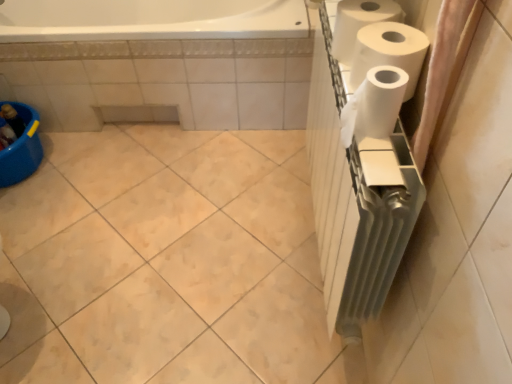
Question: Can you confirm if white matte paper towel at right, which is the first paper towel in front-to-back order, is wider than white matte paper towel at right, the second paper towel in the back-to-front sequence?

Choices:
 (A) no
 (B) yes

Answer: (A)

Question: From the image's perspective, is white matte paper towel at right, the third paper towel when ordered from back to front, located above white matte paper towel at right, the second paper towel in the back-to-front sequence?

Choices:
 (A) no
 (B) yes

Answer: (A)

Question: Considering the relative sizes of white matte paper towel at right, the third paper towel when ordered from back to front, and white matte paper towel at right, the second paper towel in the back-to-front sequence, in the image provided, is white matte paper towel at right, the third paper towel when ordered from back to front, taller than white matte paper towel at right, the second paper towel in the back-to-front sequence,?

Choices:
 (A) yes
 (B) no

Answer: (B)

Question: From a real-world perspective, is white matte paper towel at right, which is the first paper towel in front-to-back order, physically below white matte paper towel at right, the second paper towel in the back-to-front sequence?

Choices:
 (A) no
 (B) yes

Answer: (A)

Question: Is white matte paper towel at right, the third paper towel when ordered from back to front, not inside white matte paper towel at right, the second paper towel in the back-to-front sequence?

Choices:
 (A) yes
 (B) no

Answer: (A)

Question: From their relative heights in the image, would you say pink fabric shower curtain at right is taller or shorter than white matte paper towel at right, which is the first paper towel in front-to-back order?

Choices:
 (A) tall
 (B) short

Answer: (A)

Question: From a real-world perspective, is pink fabric shower curtain at right above or below white matte paper towel at right, the third paper towel when ordered from back to front?

Choices:
 (A) above
 (B) below

Answer: (A)

Question: In the image, is pink fabric shower curtain at right positioned in front of or behind white matte paper towel at right, the third paper towel when ordered from back to front?

Choices:
 (A) behind
 (B) front

Answer: (B)

Question: Is pink fabric shower curtain at right inside the boundaries of white matte paper towel at right, the third paper towel when ordered from back to front, or outside?

Choices:
 (A) inside
 (B) outside

Answer: (B)

Question: Relative to white matte paper towel at right, which is the 2th paper towel in front-to-back order, is white matte paper towel at right, which is the first paper towel in front-to-back order, in front or behind?

Choices:
 (A) front
 (B) behind

Answer: (A)

Question: Looking at their shapes, would you say white matte paper towel at right, which is the first paper towel in front-to-back order, is wider or thinner than white matte paper towel at right, which is the 2th paper towel in front-to-back order?

Choices:
 (A) wide
 (B) thin

Answer: (B)

Question: Which is correct: white matte paper towel at right, which is the first paper towel in front-to-back order, is inside white matte paper towel at right, which is the 2th paper towel in front-to-back order, or outside of it?

Choices:
 (A) inside
 (B) outside

Answer: (B)

Question: Would you say white matte paper towel at right, which is the first paper towel in front-to-back order, is to the left or to the right of white matte paper towel at right, the second paper towel in the back-to-front sequence, in the picture?

Choices:
 (A) right
 (B) left

Answer: (B)

Question: In the image, is white matte paper towel at upper right, the first paper towel in the back-to-front sequence, positioned in front of or behind pink fabric shower curtain at right?

Choices:
 (A) behind
 (B) front

Answer: (A)

Question: Considering the positions of white matte paper towel at upper right, the first paper towel in the back-to-front sequence, and pink fabric shower curtain at right in the image, is white matte paper towel at upper right, the first paper towel in the back-to-front sequence, wider or thinner than pink fabric shower curtain at right?

Choices:
 (A) wide
 (B) thin

Answer: (A)